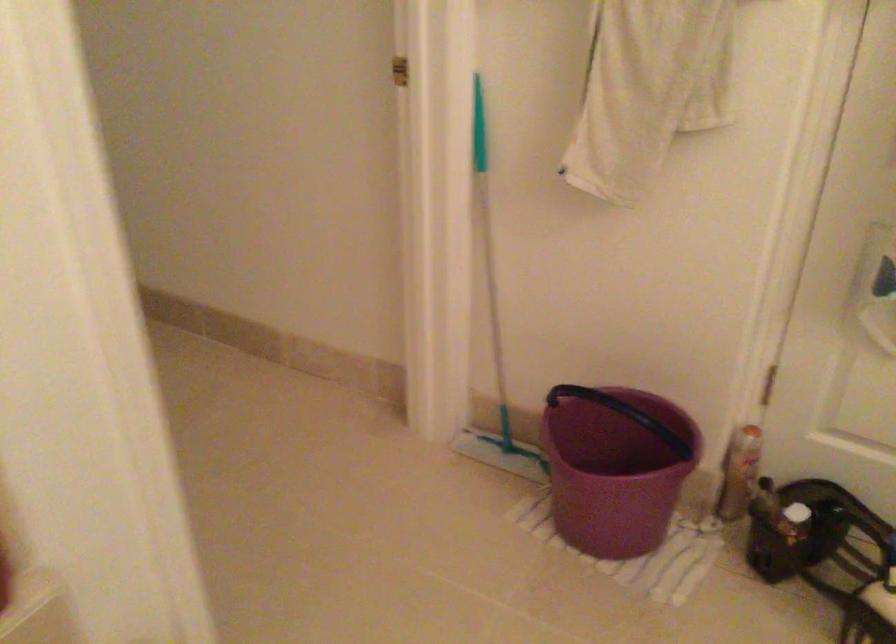
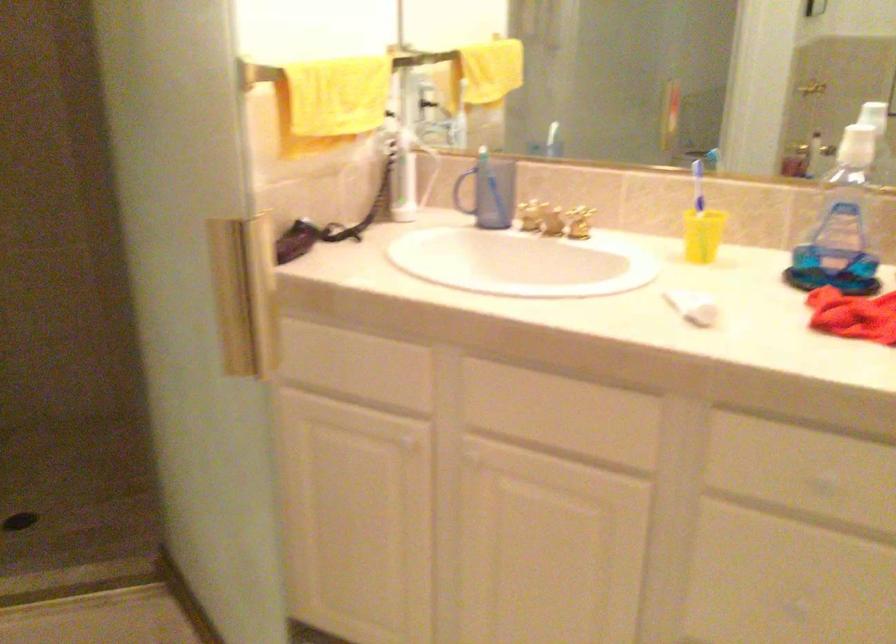
The images are taken continuously from a first-person perspective. In which direction is your viewpoint rotating?

The camera's rotation is toward right-down.